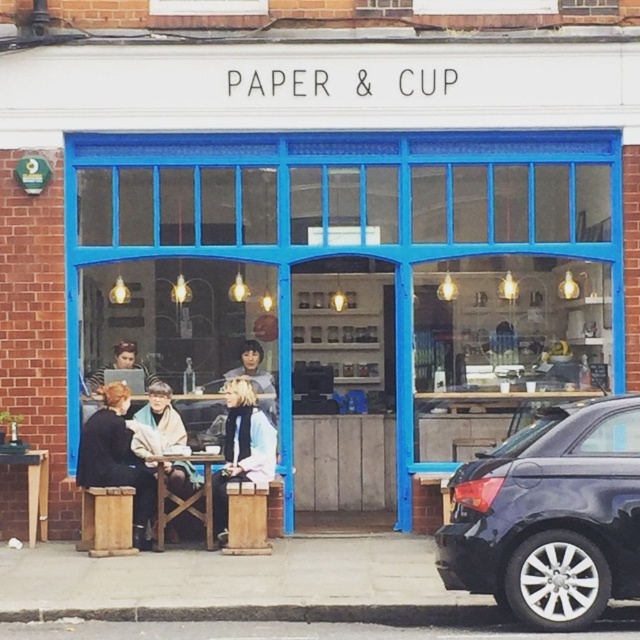
Where is `dark brown leather jacket at lower left`? The image size is (640, 640). dark brown leather jacket at lower left is located at coordinates (116, 458).

Does dark brown leather jacket at lower left appear over white woolen scarf at center?

Incorrect, dark brown leather jacket at lower left is not positioned above white woolen scarf at center.

Does point (124, 445) come in front of point (173, 480)?

No, it is behind (173, 480).

Where is `dark brown leather jacket at lower left`? dark brown leather jacket at lower left is located at coordinates (116, 458).

How distant is wooden bench at lower left from matte black laptop at center?

The distance of wooden bench at lower left from matte black laptop at center is 3.14 meters.

Can you confirm if wooden bench at lower left is smaller than matte black laptop at center?

No, wooden bench at lower left is not smaller than matte black laptop at center.

Locate an element on the screen. The image size is (640, 640). wooden bench at lower left is located at coordinates (353, 285).

Which of these two, white woolen scarf at center or blonde hair at center, stands taller?

With more height is white woolen scarf at center.

What do you see at coordinates (157, 426) in the screenshot?
I see `white woolen scarf at center` at bounding box center [157, 426].

Between point (186, 476) and point (275, 410), which one is positioned behind?

Positioned behind is point (275, 410).

Find the location of a particular element. This screenshot has width=640, height=640. white woolen scarf at center is located at coordinates (157, 426).